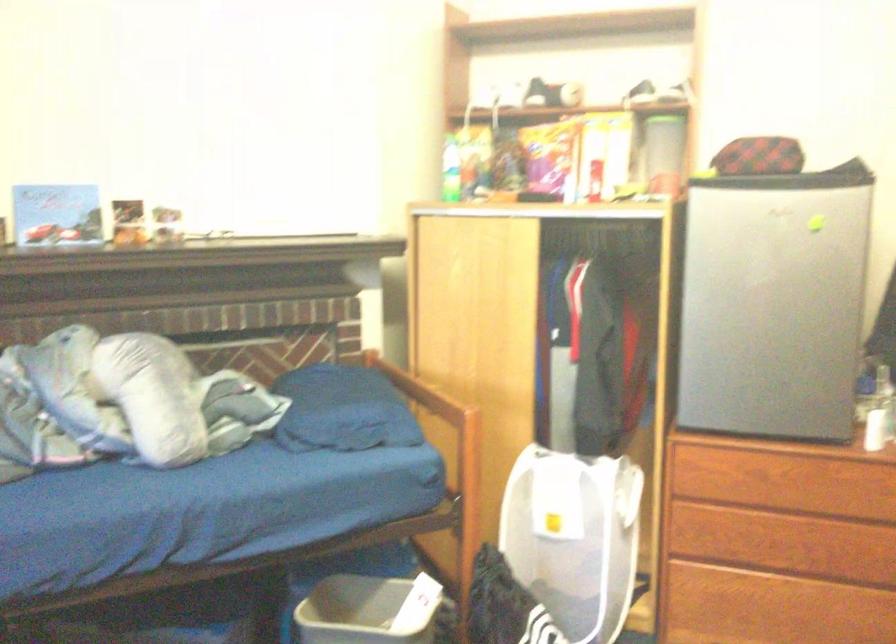
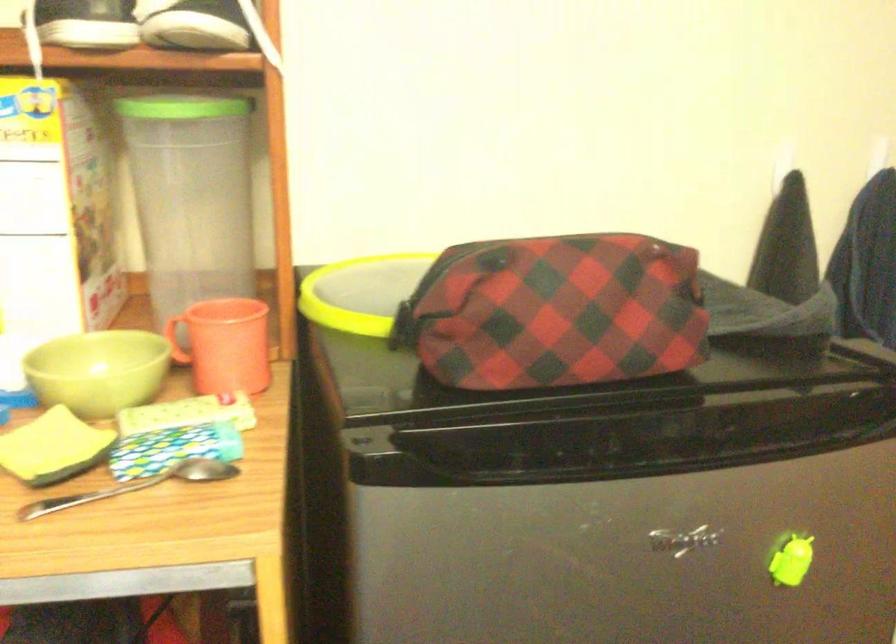
The point at (753, 149) is marked in the first image. Where is the corresponding point in the second image?

(556, 312)